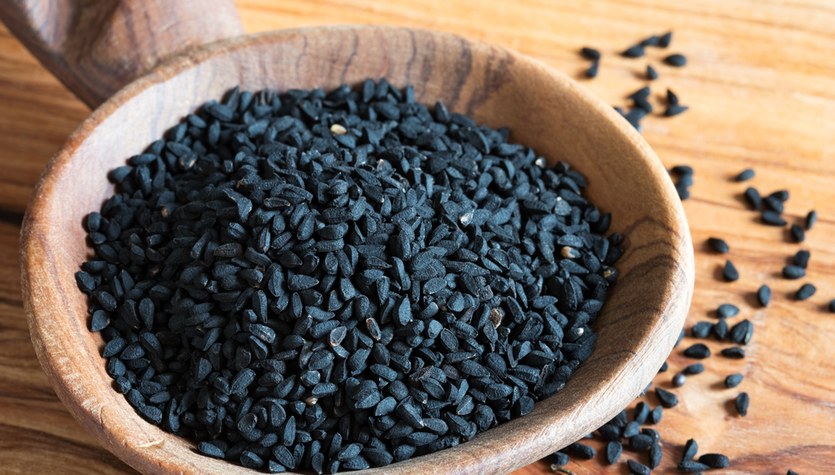
The width and height of the screenshot is (835, 475). I want to click on wood grain, so click(782, 99), click(326, 63), click(17, 146), click(125, 52).